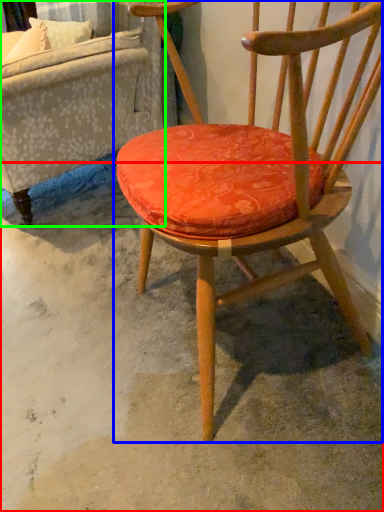
Question: Which is farther away from concrete (highlighted by a red box)? chair (highlighted by a blue box) or studio couch (highlighted by a green box)?

Choices:
 (A) chair
 (B) studio couch

Answer: (B)